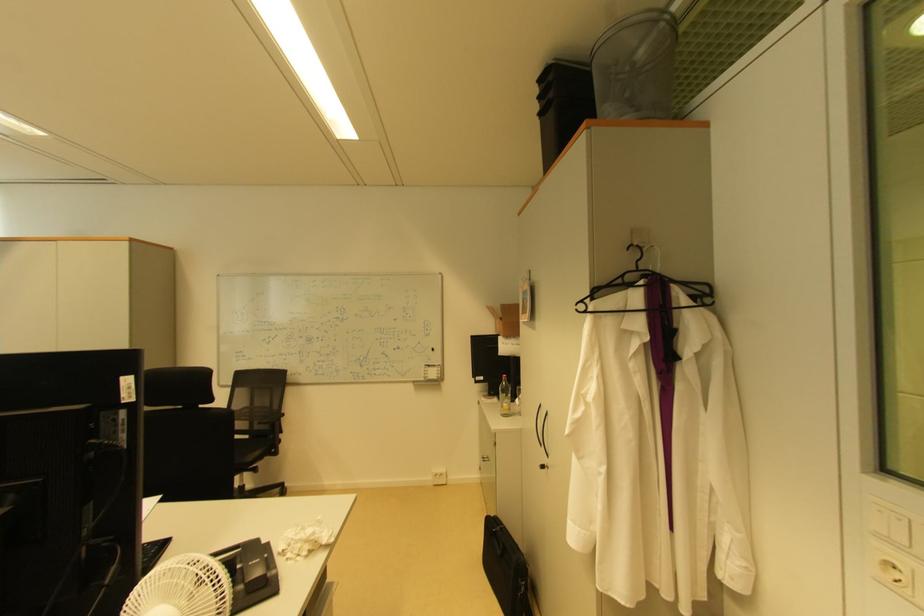
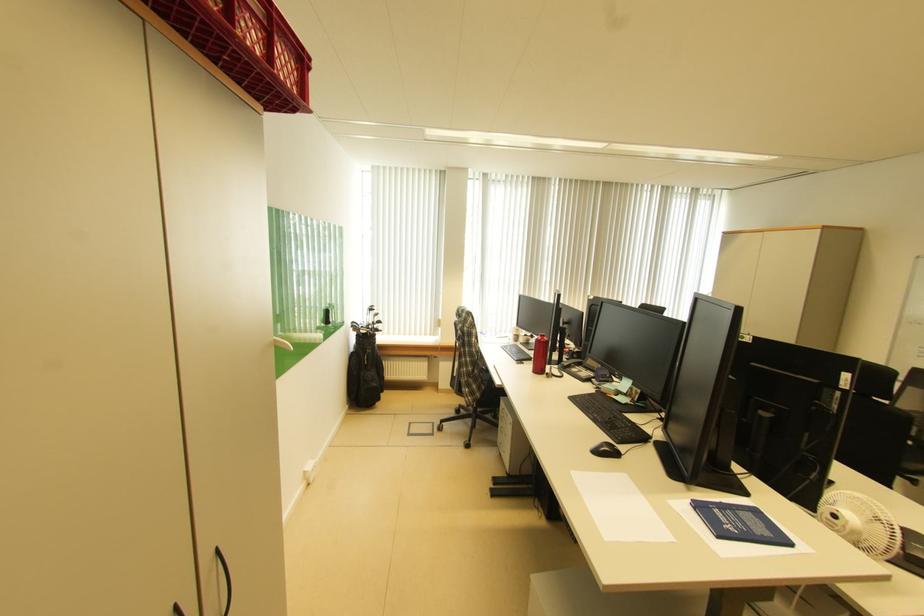
Question: The camera is either moving clockwise (left) or counter-clockwise (right) around the object. The first image is from the beginning of the video and the second image is from the end. Is the camera moving left or right when shooting the video?

Choices:
 (A) Left
 (B) Right

Answer: (B)